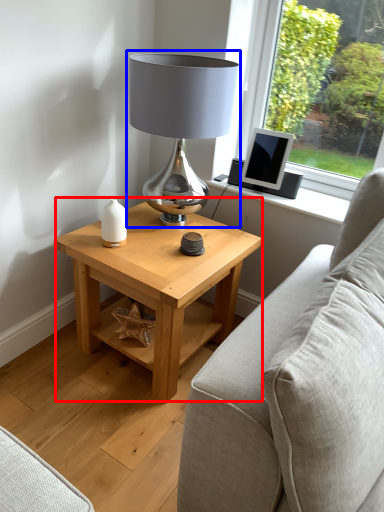
Question: Which object appears closest to the camera in this image, table (highlighted by a red box) or lamp (highlighted by a blue box)?

Choices:
 (A) table
 (B) lamp

Answer: (B)